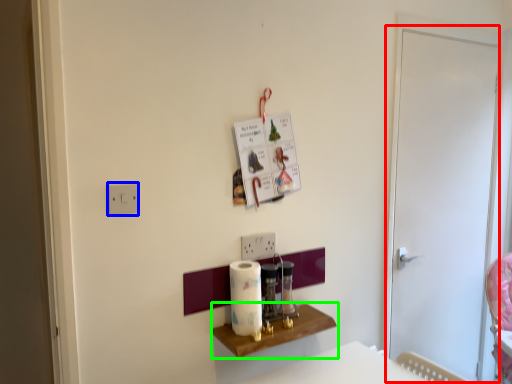
Question: Which is farther away from screen door (highlighted by a red box)? light switch (highlighted by a blue box) or furniture (highlighted by a green box)?

Choices:
 (A) light switch
 (B) furniture

Answer: (A)